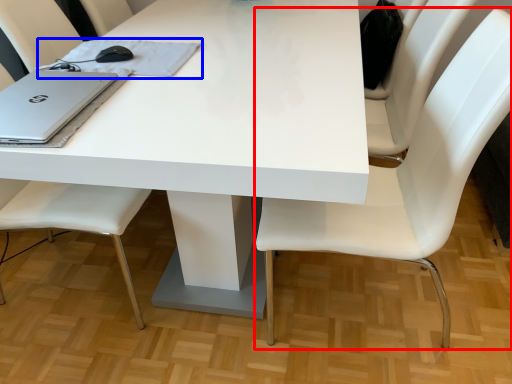
Question: Which of the following is the closest to the observer, chair (highlighted by a red box) or notebook (highlighted by a blue box)?

Choices:
 (A) chair
 (B) notebook

Answer: (A)